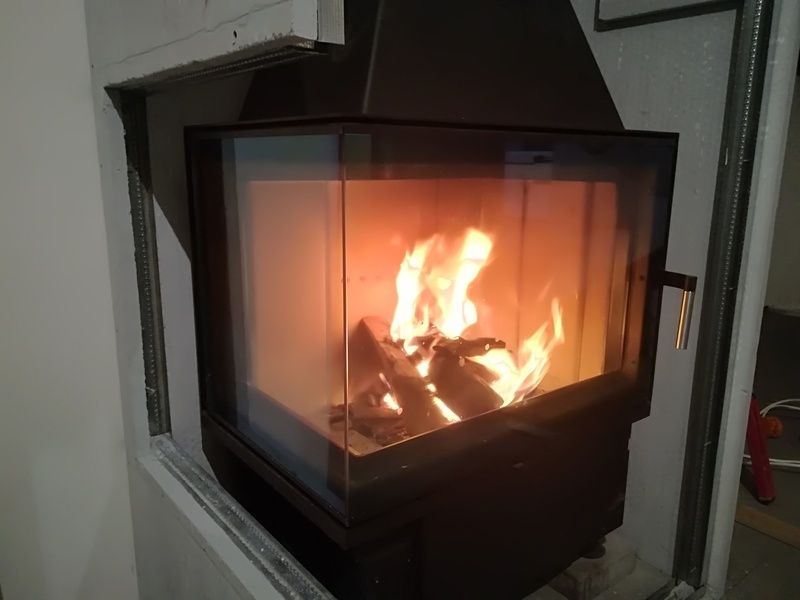
You are a GUI agent. You are given a task and a screenshot of the screen. Output one action in this format:
    pyautogui.click(x=<x>, y=<y>)
    Task: Click on the metal bracket
    The image size is (800, 600).
    Given the screenshot: What is the action you would take?
    pyautogui.click(x=258, y=537), pyautogui.click(x=140, y=270), pyautogui.click(x=250, y=58)